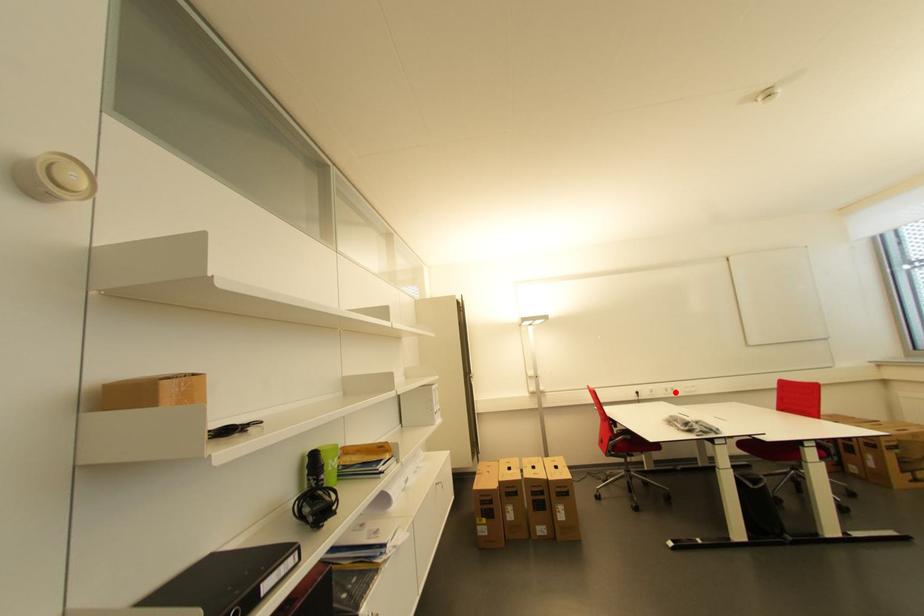
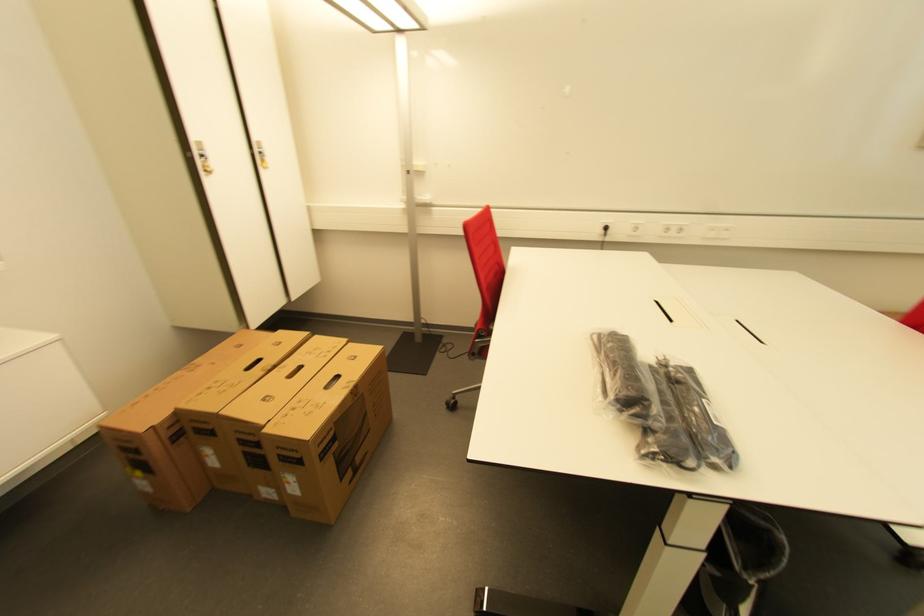
Question: I am providing you with two images of the same scene from different viewpoints. Image1 has a red point marked. In image2, the corresponding 3D location appears at what relative position? Reply with the corresponding letter.

Choices:
 (A) Closer
 (B) Farther

Answer: (A)